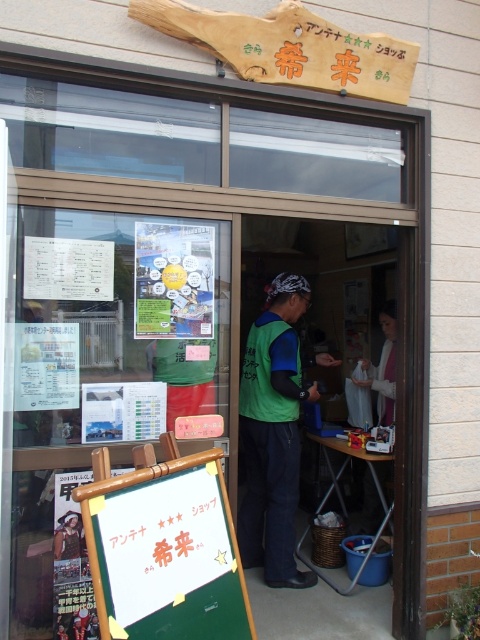
Is green chalkboard at lower left closer to the viewer compared to green fabric vest at center?

Yes.

In the scene shown: Is green chalkboard at lower left positioned behind green fabric vest at center?

No, green chalkboard at lower left is in front of green fabric vest at center.

The image size is (480, 640). What are the coordinates of `green chalkboard at lower left` in the screenshot? It's located at (165, 552).

This screenshot has height=640, width=480. I want to click on green chalkboard at lower left, so click(165, 552).

Which is below, green fabric vest at center or white cotton shirt at center?

green fabric vest at center is lower down.

Is point (285, 452) farther from viewer compared to point (379, 380)?

No, (285, 452) is in front of (379, 380).

Image resolution: width=480 pixels, height=640 pixels. What are the coordinates of `green fabric vest at center` in the screenshot? It's located at (273, 433).

Which is in front, point (165, 580) or point (389, 333)?

Point (165, 580) is more forward.

Does green chalkboard at lower left have a lesser height compared to white cotton shirt at center?

Yes, green chalkboard at lower left is shorter than white cotton shirt at center.

Does point (180, 513) come farther from viewer compared to point (382, 358)?

No, (180, 513) is in front of (382, 358).

This screenshot has width=480, height=640. Identify the location of green chalkboard at lower left. (165, 552).